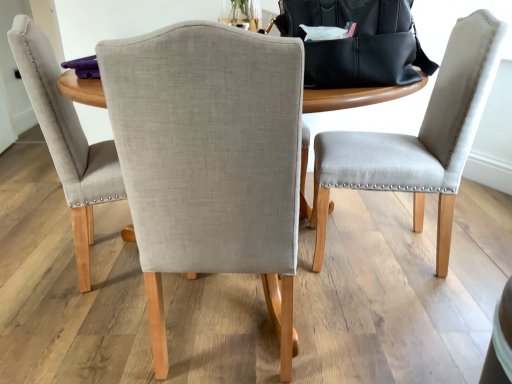
Find the location of `free spot below light gray fabric chair at center, placed as the second chair when sorted from left to right (from a real-world perspective)`. free spot below light gray fabric chair at center, placed as the second chair when sorted from left to right (from a real-world perspective) is located at coordinates (222, 327).